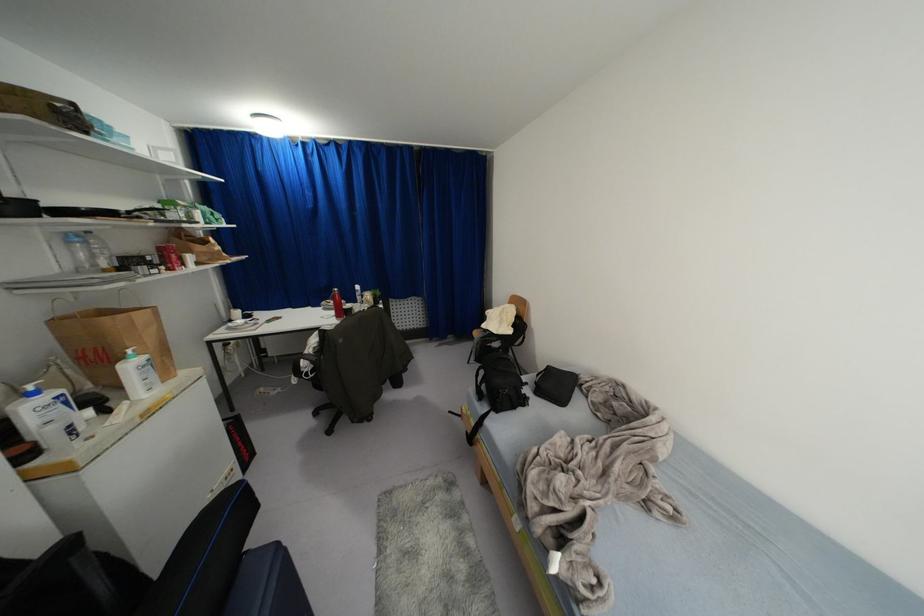
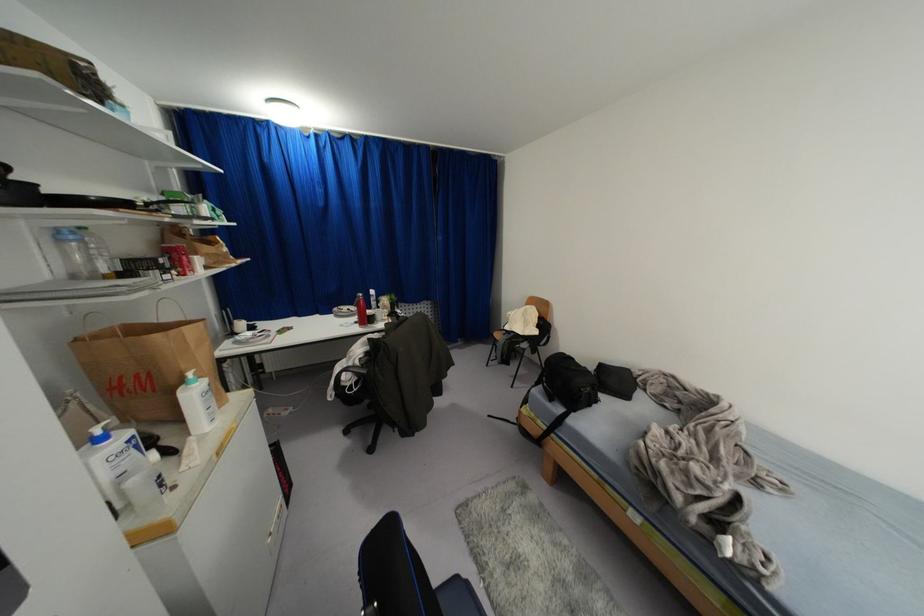
In the second image, find the point that corresponds to (334,294) in the first image.

(359, 301)